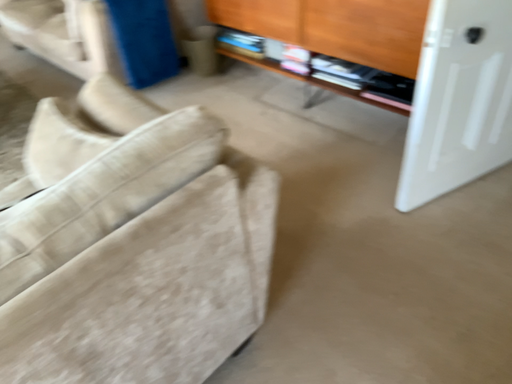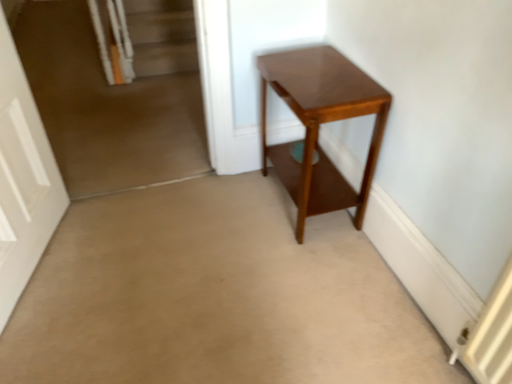
Question: Which way did the camera rotate in the video?

Choices:
 (A) rotated downward
 (B) rotated upward

Answer: (B)